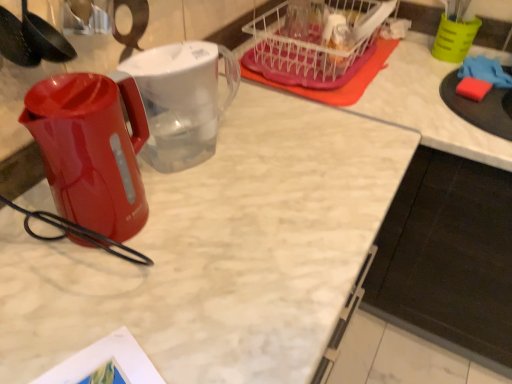
Locate an element on the screen. Image resolution: width=512 pixels, height=384 pixels. vacant space in front of transparent plastic pitcher at center is located at coordinates (206, 212).